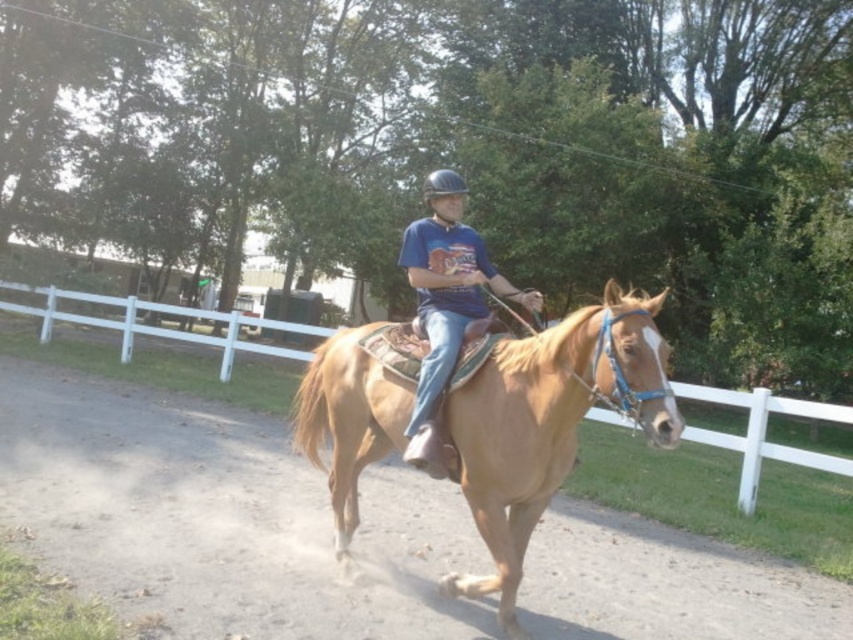
Between dusty brown dirt track at center and black hard helmet at center, which one appears on the right side from the viewer's perspective?

dusty brown dirt track at center

Does dusty brown dirt track at center have a lesser width compared to black hard helmet at center?

No.

At what (x,y) coordinates should I click in order to perform the action: click on dusty brown dirt track at center. Please return your answer as a coordinate pair (x, y). This screenshot has width=853, height=640. Looking at the image, I should click on (222, 518).

Which is behind, point (563, 378) or point (445, 374)?

Point (445, 374)

Does light brown leather horse at center have a smaller size compared to blue cotton shirt at center?

Incorrect, light brown leather horse at center is not smaller in size than blue cotton shirt at center.

You are a GUI agent. You are given a task and a screenshot of the screen. Output one action in this format:
    pyautogui.click(x=<x>, y=<y>)
    Task: Click on the light brown leather horse at center
    This screenshot has height=640, width=853.
    Given the screenshot: What is the action you would take?
    pyautogui.click(x=549, y=422)

Does dusty brown dirt track at center lie in front of light brown leather horse at center?

No, it is behind light brown leather horse at center.

Who is more distant from viewer, (784, 589) or (463, 477)?

Point (784, 589)

Which is in front, point (634, 580) or point (531, 419)?

Point (531, 419)

Locate an element on the screen. This screenshot has height=640, width=853. dusty brown dirt track at center is located at coordinates (222, 518).